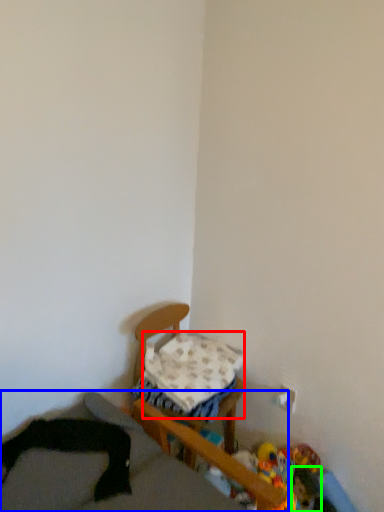
Question: Based on their relative distances, which object is nearer to pillow (highlighted by a red box)? Choose from furniture (highlighted by a blue box) and toy (highlighted by a green box).

Choices:
 (A) furniture
 (B) toy

Answer: (A)